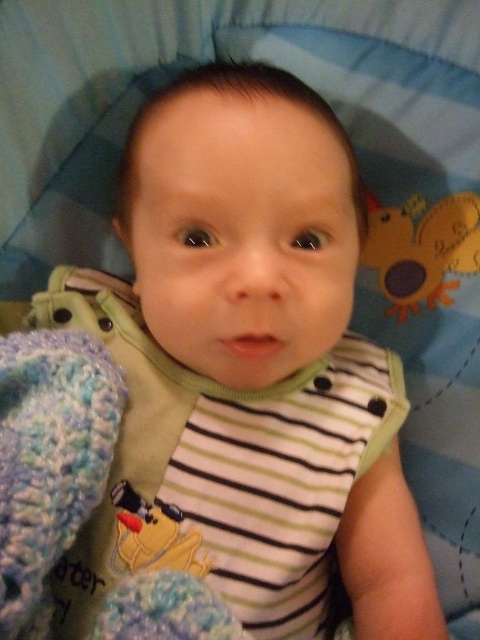
In the scene shown: Is matte yellow plush toy at upper right closer to the viewer compared to yellow plush duck at center?

No, matte yellow plush toy at upper right is further to the viewer.

Can you confirm if matte yellow plush toy at upper right is taller than yellow plush duck at center?

Yes, matte yellow plush toy at upper right is taller than yellow plush duck at center.

Does point (452, 209) come farther from viewer compared to point (191, 541)?

Yes, point (452, 209) is farther from viewer.

Locate an element on the screen. Image resolution: width=480 pixels, height=640 pixels. matte yellow plush toy at upper right is located at coordinates (421, 250).